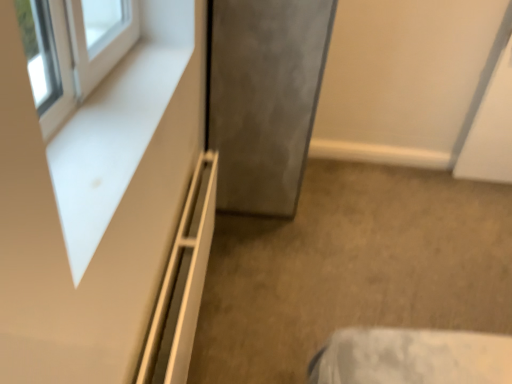
Question: Considering the relative positions of white matte dresser at upper left and satin gray door at center in the image provided, is white matte dresser at upper left to the left or to the right of satin gray door at center?

Choices:
 (A) right
 (B) left

Answer: (B)

Question: In terms of size, does white matte dresser at upper left appear bigger or smaller than satin gray door at center?

Choices:
 (A) small
 (B) big

Answer: (A)

Question: Considering the real-world distances, which object is closest to the white matte dresser at upper left?

Choices:
 (A) satin gray door at center
 (B) white matte shelf at lower left

Answer: (B)

Question: Estimate the real-world distances between objects in this image. Which object is closer to the white matte shelf at lower left?

Choices:
 (A) satin gray door at center
 (B) white matte dresser at upper left

Answer: (B)